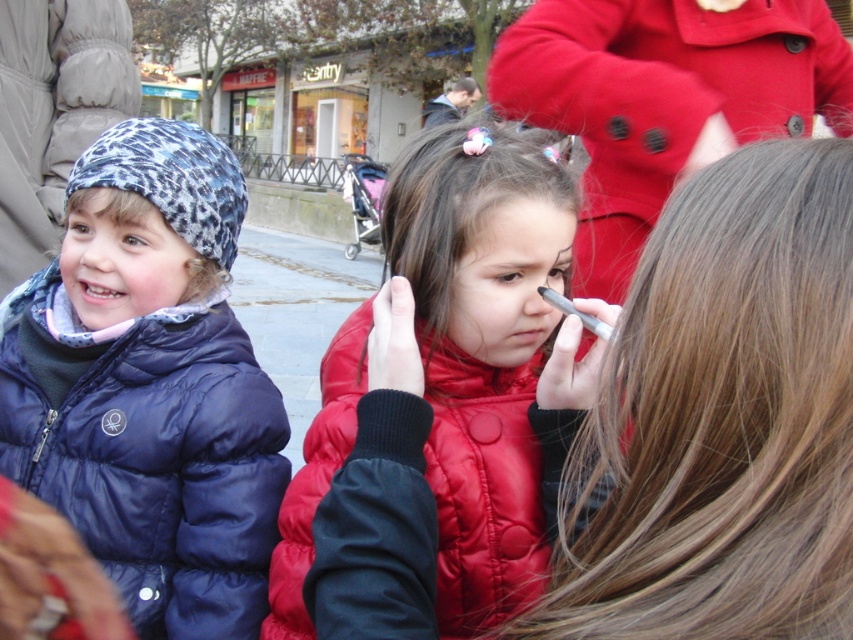
Question: Which point is closer to the camera taking this photo?

Choices:
 (A) (363, 554)
 (B) (234, 333)
 (C) (634, 84)

Answer: (A)

Question: Which object is closer to the camera taking this photo?

Choices:
 (A) matte blue puffer jacket at left
 (B) matte red coat at center
 (C) shiny red jacket at center

Answer: (C)

Question: Does shiny red jacket at center appear on the right side of matte red coat at center?

Choices:
 (A) no
 (B) yes

Answer: (A)

Question: Among these objects, which one is nearest to the camera?

Choices:
 (A) matte blue puffer jacket at left
 (B) matte red coat at center

Answer: (A)

Question: Does shiny red jacket at center appear under matte red coat at center?

Choices:
 (A) no
 (B) yes

Answer: (B)

Question: Does shiny red jacket at center have a smaller size compared to matte red coat at center?

Choices:
 (A) no
 (B) yes

Answer: (B)